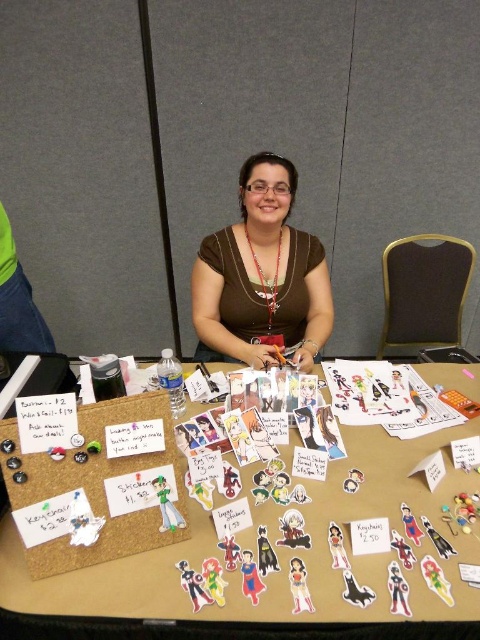
You are a customer at the convention looking to buy a necklace. You see the brown matte shirt at center and the silver metallic necklace at center. Which item is taller?

The brown matte shirt at center is taller than the silver metallic necklace at center.

Based on the photo, you are a customer at the event and want to know which item is taller between the corkboard at center and the silver metallic necklace at center. Can you tell me?

The corkboard at center is taller than the silver metallic necklace at center.

You are a customer at the event and want to know if you can easily see the prices on the stickers from the front of the table. Considering the corkboard at center and the brown matte shirt at center, which object is shorter and might block your view?

The corkboard at center is shorter than the brown matte shirt at center, so it might block your view of the sticker prices.